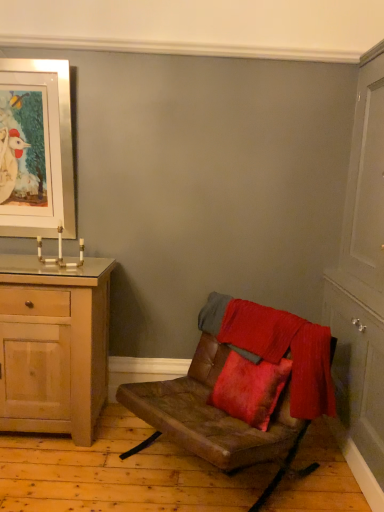
Question: From the image's perspective, is velvet red blanket at center above or below leather cushion at center?

Choices:
 (A) above
 (B) below

Answer: (A)

Question: Looking at their shapes, would you say velvet red blanket at center is wider or thinner than leather cushion at center?

Choices:
 (A) thin
 (B) wide

Answer: (A)

Question: Which of these objects is positioned closest to the white wood cabinet at right?

Choices:
 (A) light wood cabinet at left
 (B) velvet red blanket at center
 (C) silver metallic picture frame at upper left
 (D) leather cushion at center

Answer: (B)

Question: Which of these objects is positioned closest to the velvet red blanket at center?

Choices:
 (A) leather cushion at center
 (B) light wood cabinet at left
 (C) white wood cabinet at right
 (D) silver metallic picture frame at upper left

Answer: (A)